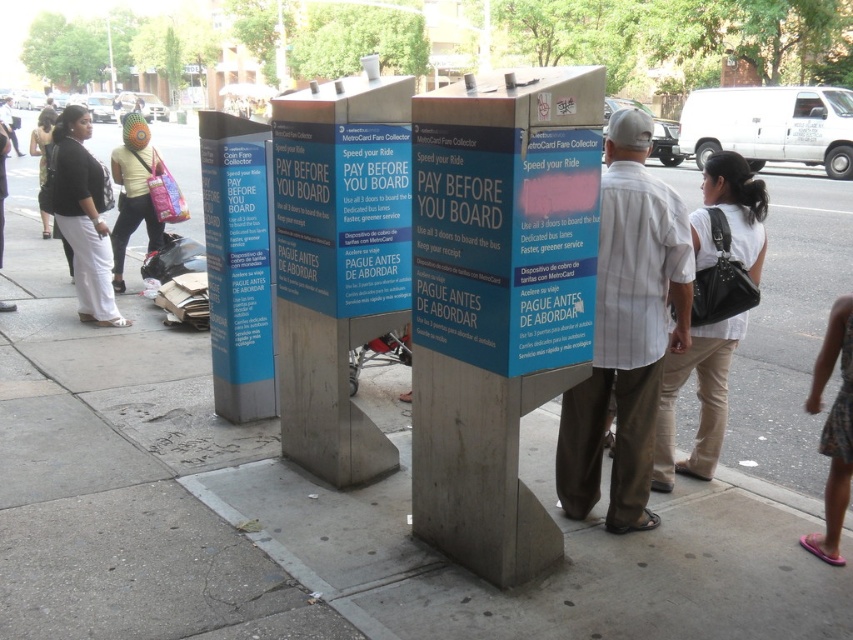
Does white cotton shirt at center appear on the right side of pink flip-flops at lower right?

Incorrect, white cotton shirt at center is not on the right side of pink flip-flops at lower right.

Which is in front, point (596, 349) or point (846, 422)?

Point (846, 422) is more forward.

You are a GUI agent. You are given a task and a screenshot of the screen. Output one action in this format:
    pyautogui.click(x=<x>, y=<y>)
    Task: Click on the white cotton shirt at center
    
    Given the screenshot: What is the action you would take?
    pyautogui.click(x=625, y=332)

Between blue plastic sign at center and white cotton shirt at center, which one is positioned higher?

blue plastic sign at center

Consider the image. Between blue plastic sign at center and white cotton shirt at center, which one appears on the right side from the viewer's perspective?

white cotton shirt at center

Who is more forward, (506, 218) or (647, 365)?

Positioned in front is point (506, 218).

Where is `blue plastic sign at center`? blue plastic sign at center is located at coordinates (508, 218).

Image resolution: width=853 pixels, height=640 pixels. What do you see at coordinates (508, 218) in the screenshot? I see `blue plastic sign at center` at bounding box center [508, 218].

Between blue plastic sign at center and matte yellow shirt at left, which one is positioned higher?

Positioned higher is matte yellow shirt at left.

Between point (508, 138) and point (126, 236), which one is positioned in front?

Point (508, 138)

This screenshot has width=853, height=640. Find the location of `blue plastic sign at center`. blue plastic sign at center is located at coordinates (508, 218).